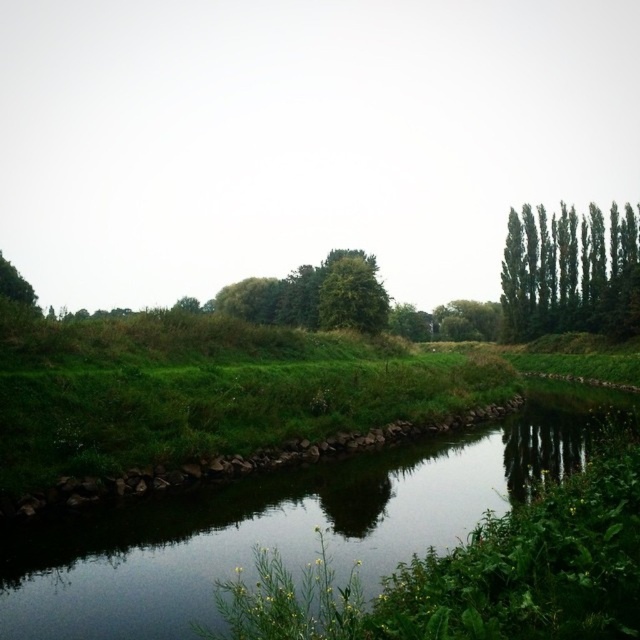
Does green leafy trees at right have a greater height compared to green leafy tree at center?

Yes, green leafy trees at right is taller than green leafy tree at center.

Is point (621, 257) behind point (381, 314)?

Yes, point (621, 257) is behind point (381, 314).

I want to click on green leafy trees at right, so click(570, 272).

Is green leafy tree at center positioned behind green leafy tree at upper left?

Yes, green leafy tree at center is behind green leafy tree at upper left.

Is point (384, 288) farther from viewer compared to point (24, 305)?

Yes.

Is point (358, 324) closer to viewer compared to point (17, 301)?

Yes, it is.

At what (x,y) coordinates should I click in order to perform the action: click on green leafy tree at center. Please return your answer as a coordinate pair (x, y). The image size is (640, 640). Looking at the image, I should click on (352, 292).

Can you confirm if green grassy river at center is thinner than green leafy trees at right?

No.

Measure the distance between green grassy river at center and green leafy trees at right.

green grassy river at center and green leafy trees at right are 60.23 meters apart from each other.

This screenshot has width=640, height=640. Find the location of `green grassy river at center`. green grassy river at center is located at coordinates (284, 524).